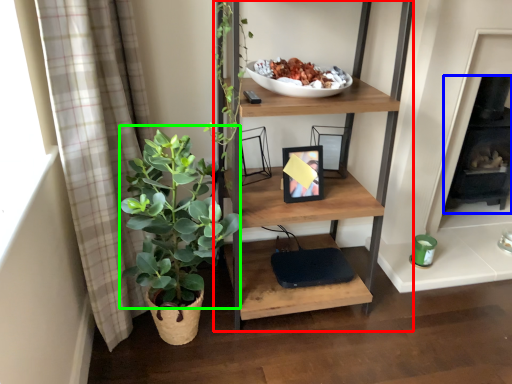
Question: Estimate the real-world distances between objects in this image. Which object is closer to shelf (highlighted by a red box), fireplace (highlighted by a blue box) or vegetation (highlighted by a green box)?

Choices:
 (A) fireplace
 (B) vegetation

Answer: (B)